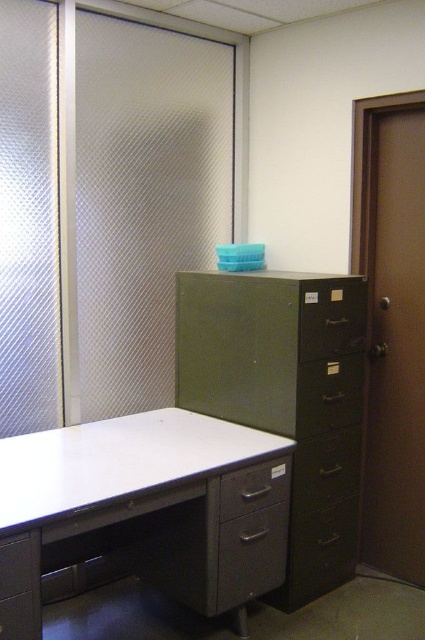
Who is lower down, brown matte door at right or matte gray drawer at lower center?

matte gray drawer at lower center is below.

Between point (413, 227) and point (263, 490), which one is positioned behind?

Point (413, 227)

Does point (419, 468) come farther from viewer compared to point (249, 500)?

Yes, it is.

The height and width of the screenshot is (640, 425). I want to click on brown matte door at right, so click(x=391, y=326).

How far apart are white matte computer desk at lower left and matte gray drawer at lower center?

white matte computer desk at lower left and matte gray drawer at lower center are 11.16 inches apart.

Between point (163, 465) and point (227, 499), which one is positioned behind?

The point (227, 499) is more distant.

Locate an element on the screen. This screenshot has width=425, height=640. white matte computer desk at lower left is located at coordinates (142, 512).

Can you confirm if green matte/file cabinet at right is taller than metallic gray drawer at lower center?

Correct, green matte/file cabinet at right is much taller as metallic gray drawer at lower center.

Is point (306, 547) positioned in front of point (229, 577)?

No, it is behind (229, 577).

Where is `green matte/file cabinet at right`? green matte/file cabinet at right is located at coordinates (286, 396).